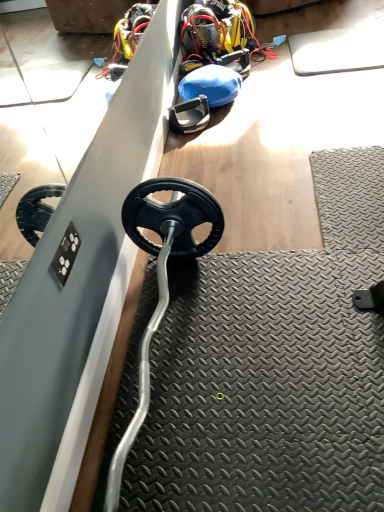
Identify the location of black rubber wheel at center. [190, 116].

Image resolution: width=384 pixels, height=512 pixels. What do you see at coordinates (190, 116) in the screenshot?
I see `black rubber wheel at center` at bounding box center [190, 116].

Image resolution: width=384 pixels, height=512 pixels. I want to click on black rubber wheel at center, so click(190, 116).